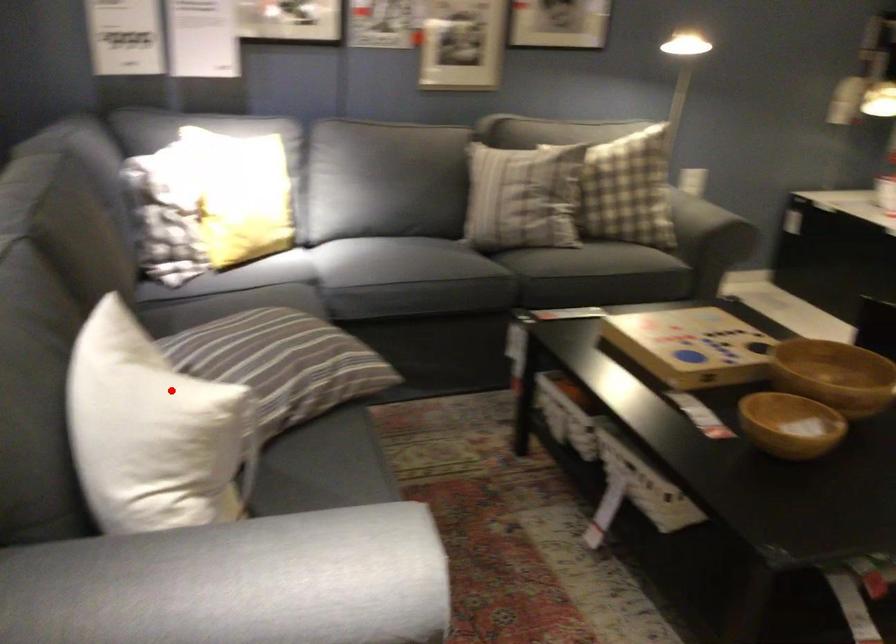
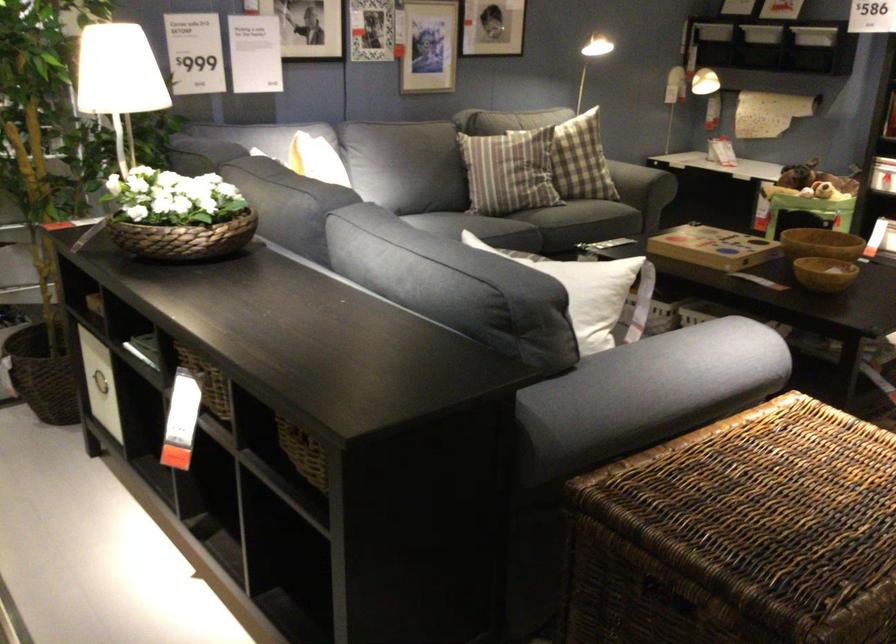
Question: I am providing you with two images of the same scene from different viewpoints. Image1 has a red point marked. In image2, the corresponding 3D location appears at what relative position? Reply with the corresponding letter.

Choices:
 (A) Closer
 (B) Farther

Answer: (B)